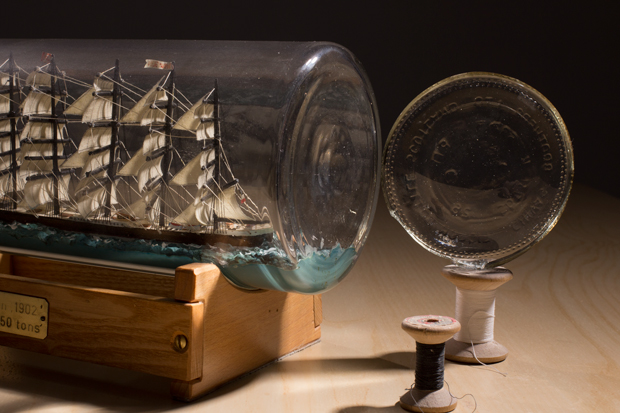
In order to click on light brown table in this screenshot , I will do `click(542, 315)`.